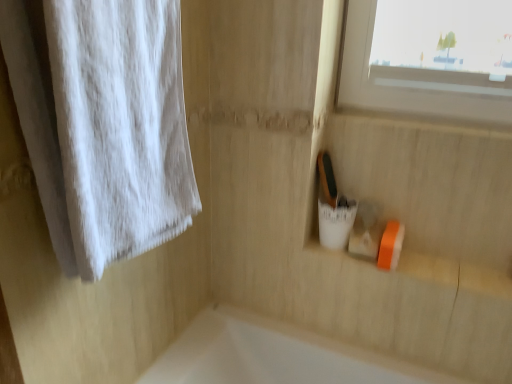
Question: Is orange rubber at lower right shorter than white cotton towel at left?

Choices:
 (A) no
 (B) yes

Answer: (B)

Question: Is orange rubber at lower right positioned far away from white cotton towel at left?

Choices:
 (A) no
 (B) yes

Answer: (A)

Question: Is orange rubber at lower right to the right of white cotton towel at left from the viewer's perspective?

Choices:
 (A) yes
 (B) no

Answer: (A)

Question: Can you confirm if orange rubber at lower right is smaller than white cotton towel at left?

Choices:
 (A) yes
 (B) no

Answer: (A)

Question: Is orange rubber at lower right in front of white cotton towel at left?

Choices:
 (A) yes
 (B) no

Answer: (B)

Question: Is orange rubber at lower right thinner than white cotton towel at left?

Choices:
 (A) yes
 (B) no

Answer: (A)

Question: Is white cotton towel at left looking in the opposite direction of orange rubber at lower right?

Choices:
 (A) yes
 (B) no

Answer: (B)

Question: Can you confirm if white cotton towel at left is taller than orange rubber at lower right?

Choices:
 (A) no
 (B) yes

Answer: (B)

Question: From the image's perspective, does white cotton towel at left appear lower than orange rubber at lower right?

Choices:
 (A) no
 (B) yes

Answer: (A)

Question: Is orange rubber at lower right surrounded by white cotton towel at left?

Choices:
 (A) yes
 (B) no

Answer: (B)

Question: Can you confirm if white cotton towel at left is positioned to the right of orange rubber at lower right?

Choices:
 (A) no
 (B) yes

Answer: (A)

Question: Are white cotton towel at left and orange rubber at lower right far apart?

Choices:
 (A) yes
 (B) no

Answer: (B)

Question: Choose the correct answer: Is white cotton towel at left inside orange rubber at lower right or outside it?

Choices:
 (A) outside
 (B) inside

Answer: (A)